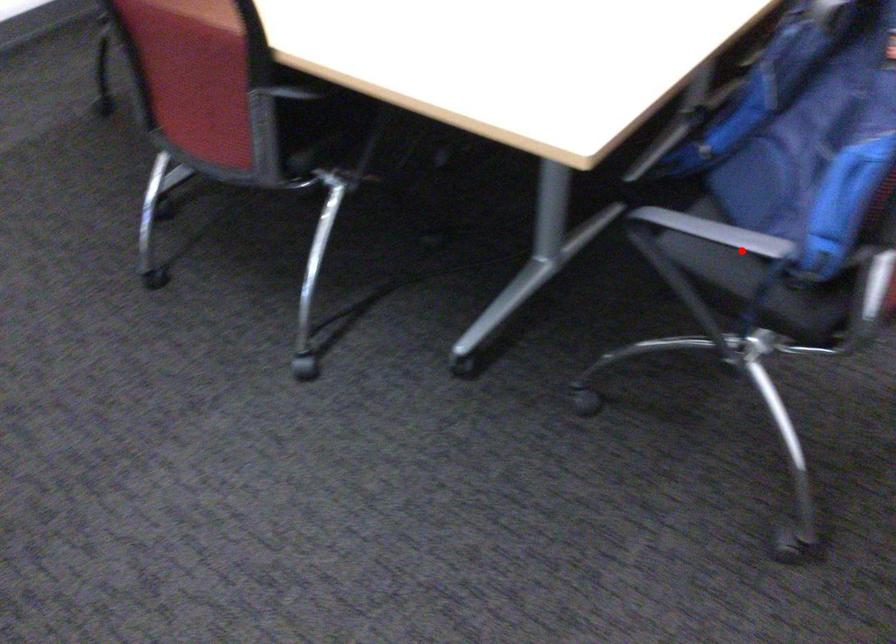
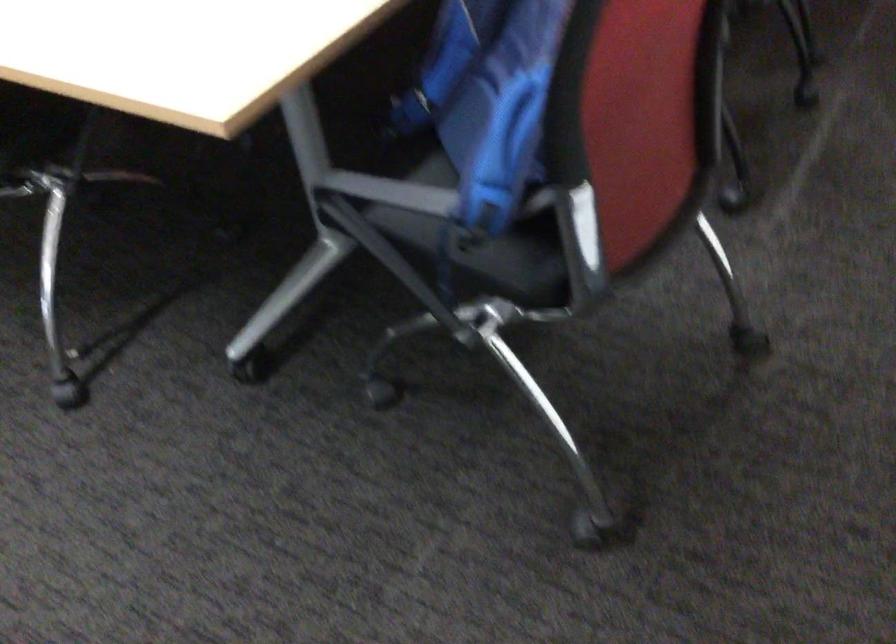
Question: I am providing you with two images of the same scene from different viewpoints. A red point is shown in image1. For the corresponding object point in image2, is it positioned nearer or farther from the camera?

Choices:
 (A) Nearer
 (B) Farther

Answer: (A)